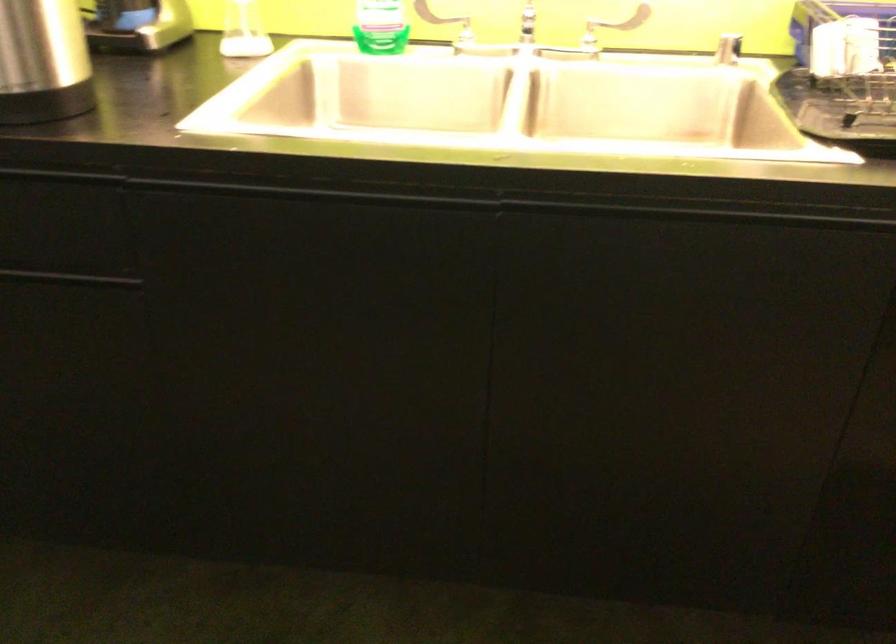
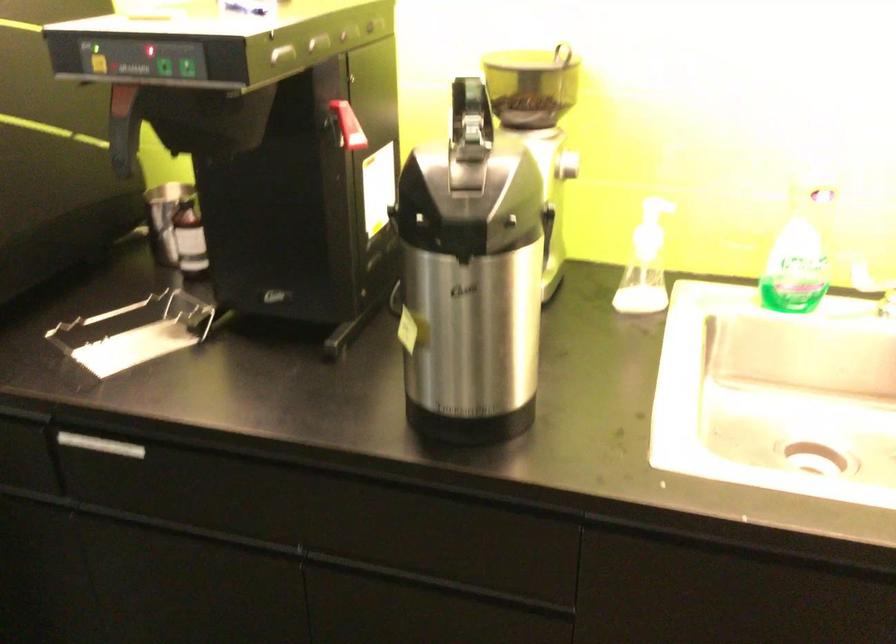
Question: Based on the continuous images, in which direction is the camera rotating? Reply with the corresponding letter.

Choices:
 (A) Left
 (B) Right
 (C) Up
 (D) Down

Answer: (A)